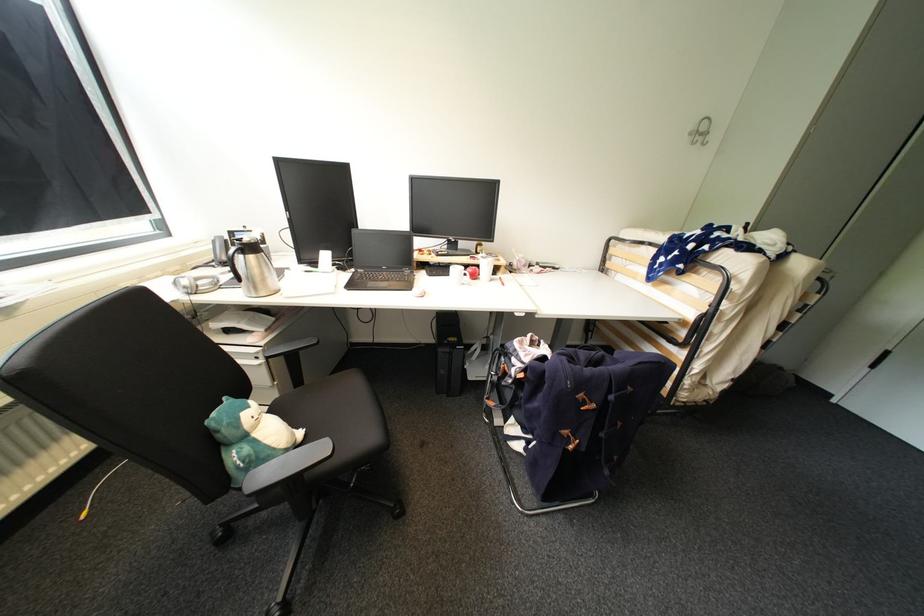
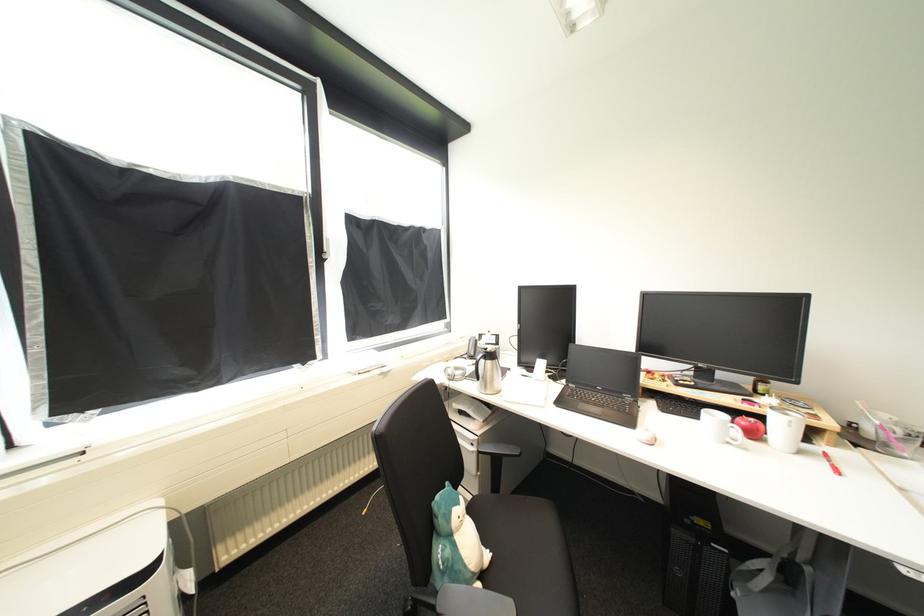
Where in the second image is the point corresponding to point (469, 285) from the first image?

(736, 445)